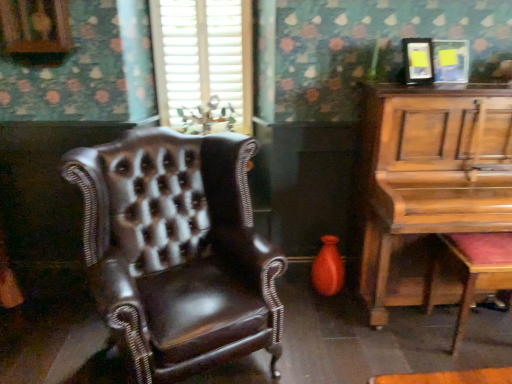
Question: Can you confirm if white textured blinds at upper center is wider than wooden piano at right?

Choices:
 (A) no
 (B) yes

Answer: (A)

Question: Does white textured blinds at upper center have a lesser width compared to wooden piano at right?

Choices:
 (A) no
 (B) yes

Answer: (B)

Question: Does white textured blinds at upper center have a greater height compared to wooden piano at right?

Choices:
 (A) no
 (B) yes

Answer: (A)

Question: Is white textured blinds at upper center at the right side of wooden piano at right?

Choices:
 (A) no
 (B) yes

Answer: (A)

Question: Is white textured blinds at upper center not near wooden piano at right?

Choices:
 (A) yes
 (B) no

Answer: (A)

Question: Could you tell me if white textured blinds at upper center is facing wooden piano at right?

Choices:
 (A) yes
 (B) no

Answer: (B)

Question: Would you say white textured blinds at upper center contains wooden polished music stool at lower right?

Choices:
 (A) no
 (B) yes

Answer: (A)

Question: Is white textured blinds at upper center positioned before wooden polished music stool at lower right?

Choices:
 (A) yes
 (B) no

Answer: (B)

Question: Does white textured blinds at upper center have a lesser height compared to wooden polished music stool at lower right?

Choices:
 (A) yes
 (B) no

Answer: (B)

Question: Can you confirm if white textured blinds at upper center is positioned to the right of wooden polished music stool at lower right?

Choices:
 (A) no
 (B) yes

Answer: (A)

Question: From the image's perspective, is white textured blinds at upper center below wooden polished music stool at lower right?

Choices:
 (A) yes
 (B) no

Answer: (B)

Question: From the image's perspective, would you say white textured blinds at upper center is positioned over wooden polished music stool at lower right?

Choices:
 (A) no
 (B) yes

Answer: (B)

Question: Is white textured blinds at upper center surrounded by wooden polished music stool at lower right?

Choices:
 (A) yes
 (B) no

Answer: (B)